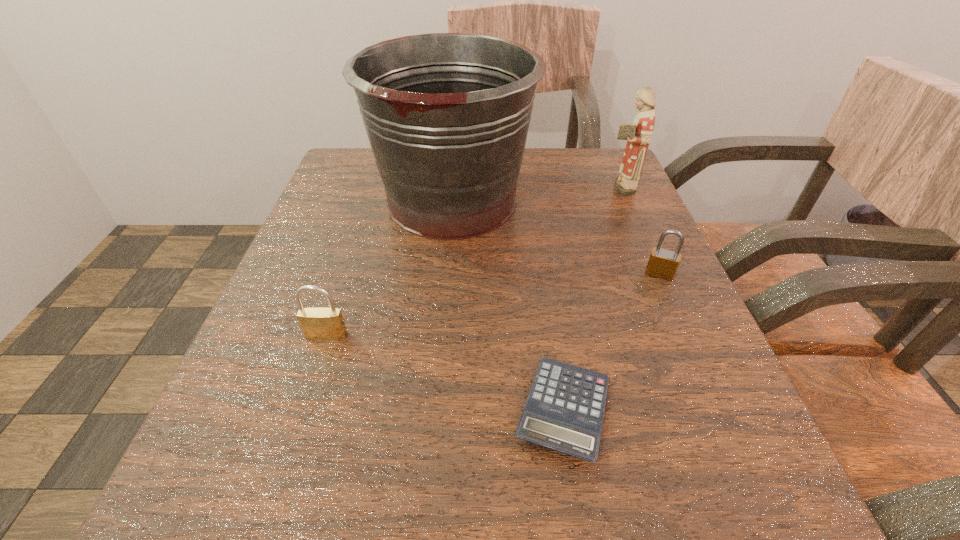
Find the location of `free point between the fourth shortest object and the fourth farthest object`. free point between the fourth shortest object and the fourth farthest object is located at coordinates (472, 261).

Find the location of a particular element. vacant space that is in between the left padlock and the calculator is located at coordinates (445, 373).

Where is `free point between the calculator and the left padlock`? free point between the calculator and the left padlock is located at coordinates (445, 373).

The image size is (960, 540). What are the coordinates of `empty space that is in between the second nearest object and the third nearest object` in the screenshot? It's located at (493, 305).

Point out which object is positioned as the third nearest to the bucket. Please provide its 2D coordinates. Your answer should be formatted as a tuple, i.e. [(x, y)], where the tuple contains the x and y coordinates of a point satisfying the conditions above.

[(317, 323)]

I want to click on object that is the second nearest to the calculator, so click(x=447, y=115).

The height and width of the screenshot is (540, 960). In order to click on free space in the image that satisfies the following two spatial constraints: 1. on the front-facing side of the figurine; 2. on the left side of the third nearest object in this screenshot , I will do `click(656, 274)`.

Where is `vacant point that satisfies the following two spatial constraints: 1. on the front-facing side of the second tallest object; 2. on the front-facing side of the nearer padlock`? The height and width of the screenshot is (540, 960). vacant point that satisfies the following two spatial constraints: 1. on the front-facing side of the second tallest object; 2. on the front-facing side of the nearer padlock is located at coordinates (683, 335).

Where is `free region that satisfies the following two spatial constraints: 1. on the front-facing side of the fourth shortest object; 2. on the front-facing side of the nearer padlock`? free region that satisfies the following two spatial constraints: 1. on the front-facing side of the fourth shortest object; 2. on the front-facing side of the nearer padlock is located at coordinates (683, 335).

The height and width of the screenshot is (540, 960). In order to click on free location that satisfies the following two spatial constraints: 1. on the front-facing side of the second tallest object; 2. on the front-facing side of the second nearest object in this screenshot , I will do [x=683, y=335].